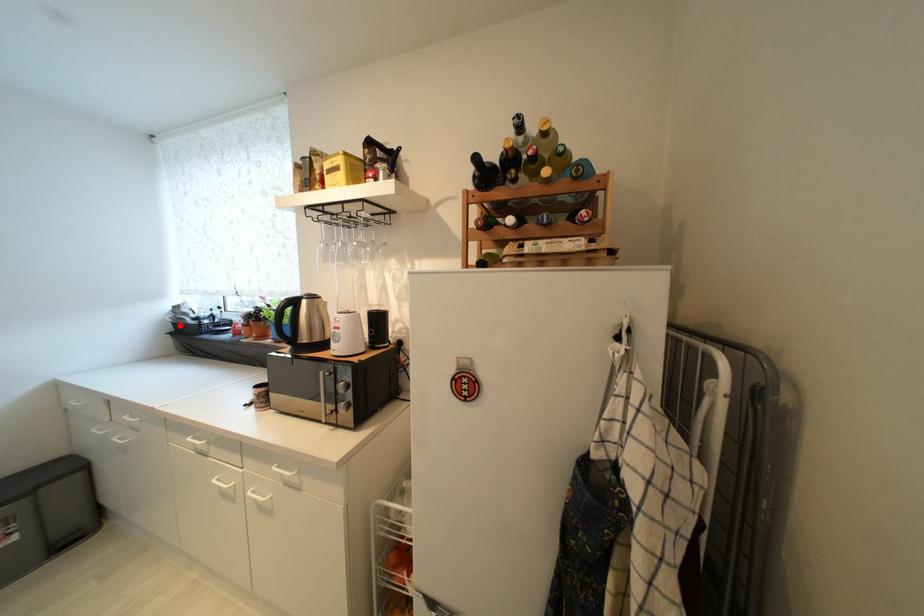
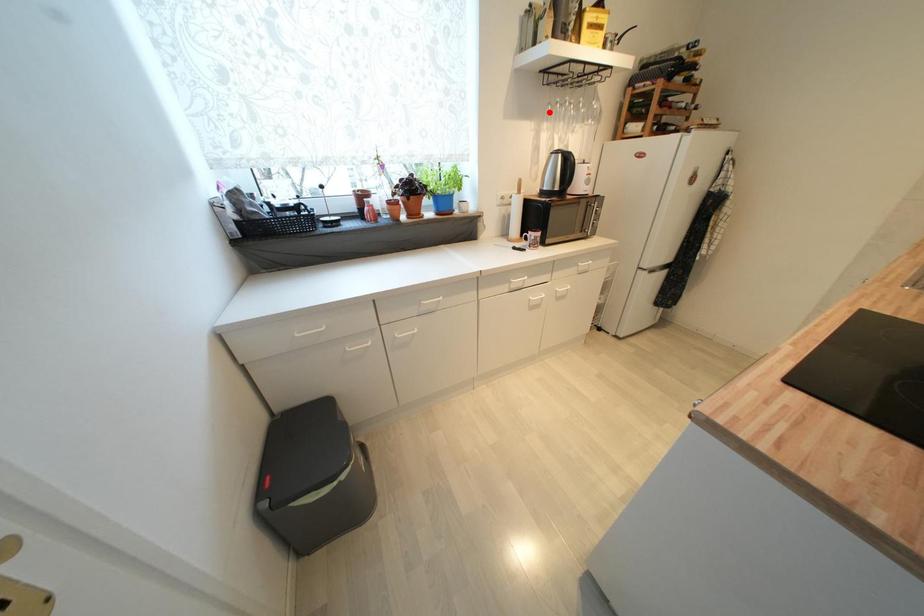
I am providing you with two images of the same scene from different viewpoints. A red point is marked on the first image and another point is marked on the second image. Does the point marked in image1 correspond to the same location as the one in image2?

No